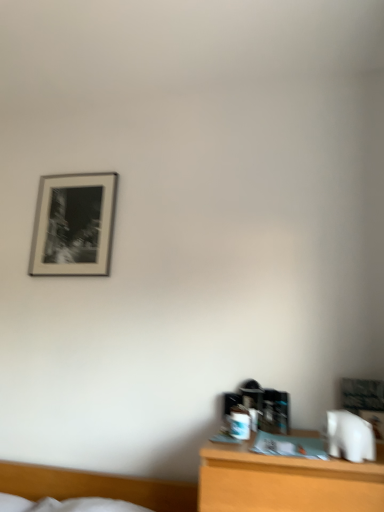
Question: Are silver metallic picture frame at upper left and white soft bed at lower left making contact?

Choices:
 (A) yes
 (B) no

Answer: (B)

Question: Is silver metallic picture frame at upper left at the right side of white soft bed at lower left?

Choices:
 (A) no
 (B) yes

Answer: (A)

Question: Is white soft bed at lower left surrounded by silver metallic picture frame at upper left?

Choices:
 (A) yes
 (B) no

Answer: (B)

Question: Is silver metallic picture frame at upper left aimed at white soft bed at lower left?

Choices:
 (A) yes
 (B) no

Answer: (B)

Question: Can you confirm if silver metallic picture frame at upper left is wider than white soft bed at lower left?

Choices:
 (A) yes
 (B) no

Answer: (B)

Question: Is silver metallic picture frame at upper left taller than white soft bed at lower left?

Choices:
 (A) yes
 (B) no

Answer: (A)

Question: From a real-world perspective, does white soft bed at lower left stand above silver metallic picture frame at upper left?

Choices:
 (A) no
 (B) yes

Answer: (A)

Question: From the image's perspective, is white soft bed at lower left over silver metallic picture frame at upper left?

Choices:
 (A) no
 (B) yes

Answer: (A)

Question: Is white soft bed at lower left oriented away from silver metallic picture frame at upper left?

Choices:
 (A) yes
 (B) no

Answer: (B)

Question: Considering the relative sizes of white soft bed at lower left and silver metallic picture frame at upper left in the image provided, is white soft bed at lower left thinner than silver metallic picture frame at upper left?

Choices:
 (A) yes
 (B) no

Answer: (B)

Question: From a real-world perspective, is white soft bed at lower left beneath silver metallic picture frame at upper left?

Choices:
 (A) yes
 (B) no

Answer: (A)

Question: Is white soft bed at lower left not close to silver metallic picture frame at upper left?

Choices:
 (A) yes
 (B) no

Answer: (A)

Question: In terms of width, does silver metallic picture frame at upper left look wider or thinner when compared to white soft bed at lower left?

Choices:
 (A) wide
 (B) thin

Answer: (B)